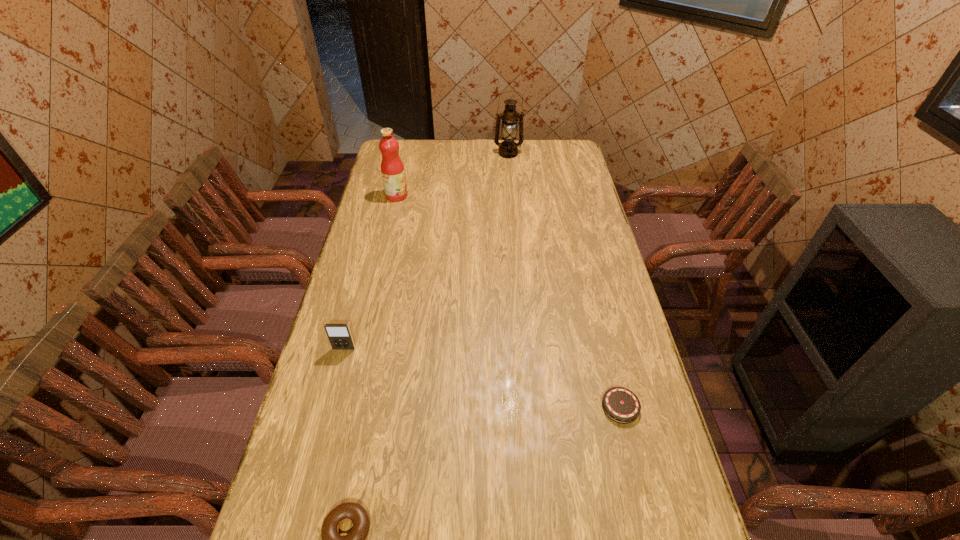
Locate an element on the screen. This screenshot has width=960, height=540. free space located on the left of the rightmost object is located at coordinates (485, 407).

I want to click on object that is at the far edge, so click(x=508, y=148).

At what (x,y) coordinates should I click in order to perform the action: click on fruit juice located at the left edge. Please return your answer as a coordinate pair (x, y). The width and height of the screenshot is (960, 540). Looking at the image, I should click on (392, 168).

Where is `iPod that is at the left edge`? Image resolution: width=960 pixels, height=540 pixels. iPod that is at the left edge is located at coordinates (339, 335).

The height and width of the screenshot is (540, 960). What are the coordinates of `object that is at the right edge` in the screenshot? It's located at (621, 405).

Identify the location of free space at the far edge of the desktop. The image size is (960, 540). (535, 164).

Locate an element on the screen. vacant space at the left edge is located at coordinates (337, 483).

The width and height of the screenshot is (960, 540). What are the coordinates of `vacant area at the right edge` in the screenshot? It's located at (579, 194).

Identify the location of free space at the far right corner. This screenshot has width=960, height=540. (547, 158).

The height and width of the screenshot is (540, 960). What are the coordinates of `unoccupied area between the farthest object and the fruit juice` in the screenshot? It's located at (452, 175).